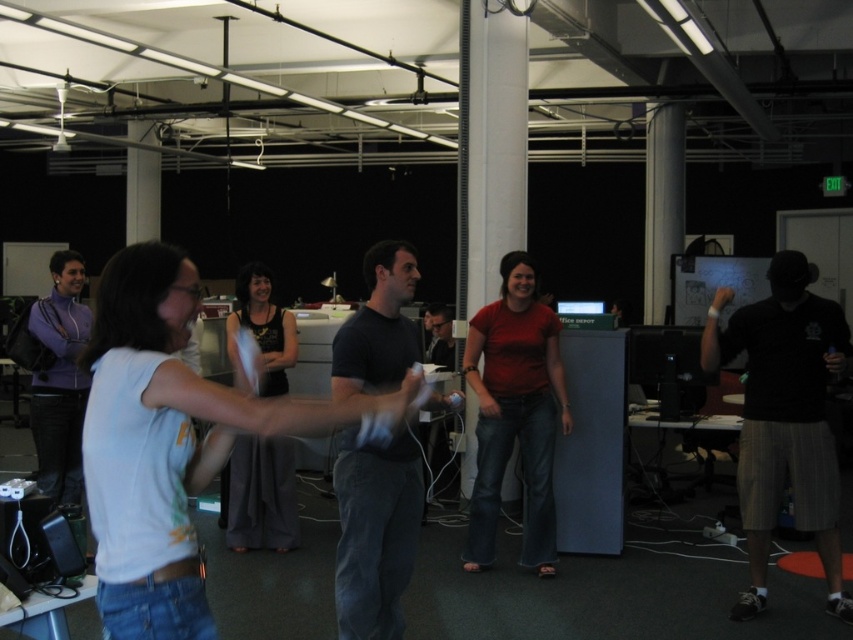
Question: In this image, where is dark gray cotton t-shirt at center located relative to black tank top at center?

Choices:
 (A) below
 (B) above

Answer: (B)

Question: Which point appears closest to the camera in this image?

Choices:
 (A) (347, 605)
 (B) (67, 396)
 (C) (534, 525)
 (D) (770, 330)

Answer: (A)

Question: Does black cotton shirt at right appear on the left side of dark gray cotton t-shirt at center?

Choices:
 (A) no
 (B) yes

Answer: (A)

Question: Is black cotton shirt at right wider than purple fleece jacket at left?

Choices:
 (A) no
 (B) yes

Answer: (B)

Question: Which object appears closest to the camera in this image?

Choices:
 (A) black tank top at center
 (B) dark gray cotton t-shirt at center
 (C) purple fleece jacket at left

Answer: (B)

Question: Which object is positioned closest to the black tank top at center?

Choices:
 (A) black cotton shirt at right
 (B) dark gray cotton t-shirt at center

Answer: (B)